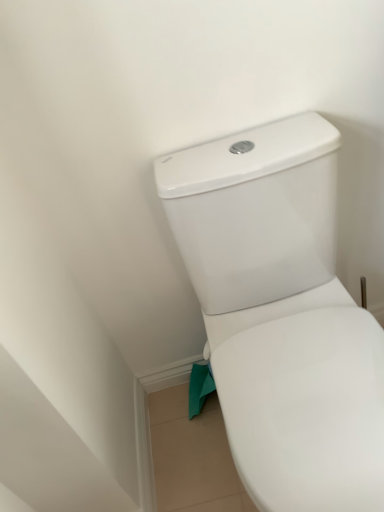
The width and height of the screenshot is (384, 512). Describe the element at coordinates (281, 314) in the screenshot. I see `white glossy toilet at center` at that location.

Find the location of `white glossy toilet at center`. white glossy toilet at center is located at coordinates (281, 314).

In order to click on white glossy toilet at center in this screenshot , I will do `click(281, 314)`.